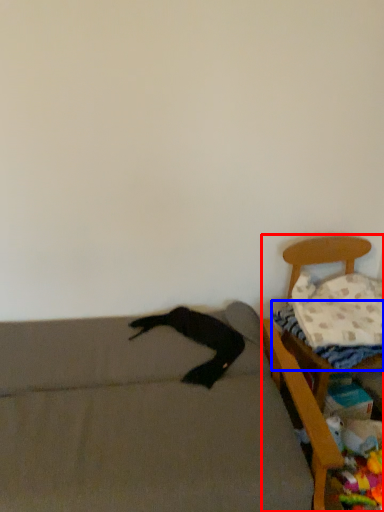
Question: Which point is closer to the camera, furniture (highlighted by a red box) or sheet (highlighted by a blue box)?

Choices:
 (A) furniture
 (B) sheet

Answer: (A)